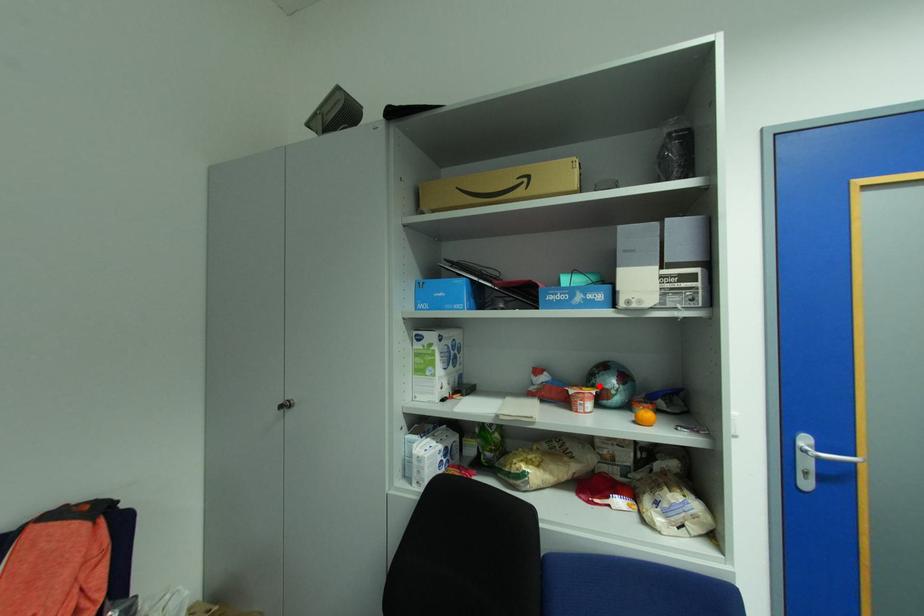
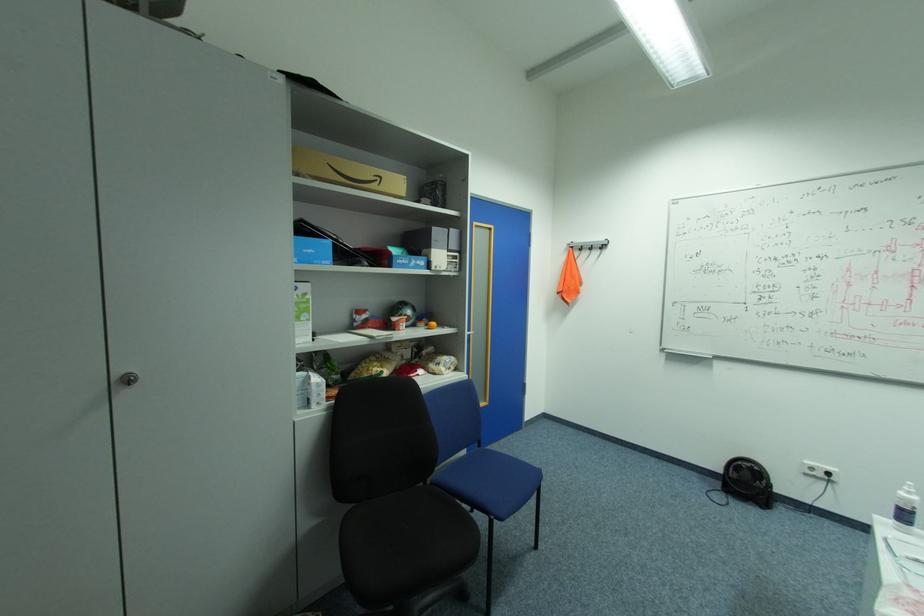
The point at the highlighted location is marked in the first image. Where is the corresponding point in the second image?

(407, 315)